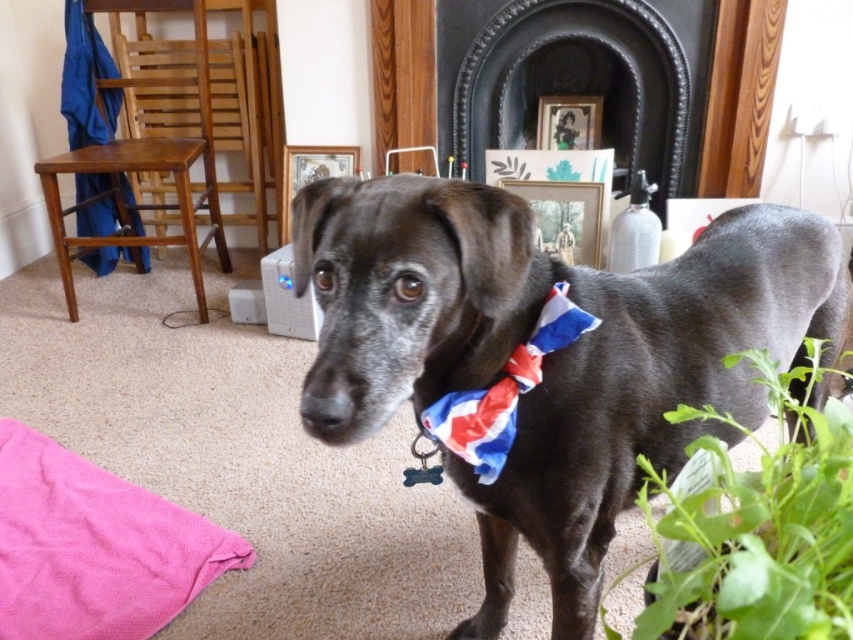
Between black matte fireplace at upper center and union jack fabric bow tie at center, which one has less height?

Standing shorter between the two is union jack fabric bow tie at center.

Measure the distance between black matte fireplace at upper center and camera.

black matte fireplace at upper center is 8.17 feet from camera.

Which is behind, point (653, 106) or point (556, 333)?

The point (653, 106) is more distant.

Locate an element on the screen. black matte fireplace at upper center is located at coordinates (577, 77).

Is shiny black dog at center to the right of black matte fireplace at upper center from the viewer's perspective?

No, shiny black dog at center is not to the right of black matte fireplace at upper center.

Measure the distance between point (677, 301) and camera.

A distance of 1.03 meters exists between point (677, 301) and camera.

In the scene shown: Measure the distance between point (787, 337) and camera.

The distance of point (787, 337) from camera is 3.72 feet.

Where is `shiny black dog at center`? The width and height of the screenshot is (853, 640). shiny black dog at center is located at coordinates (549, 353).

Consider the image. Is green leafy plant at lower right positioned at the back of union jack fabric bow tie at center?

No, green leafy plant at lower right is in front of union jack fabric bow tie at center.

Looking at this image, who is more forward, [755,621] or [554,298]?

Point [755,621] is more forward.

Who is more distant from viewer, (x=758, y=632) or (x=587, y=324)?

Point (x=587, y=324)

Where is `green leafy plant at lower right`? green leafy plant at lower right is located at coordinates (757, 534).